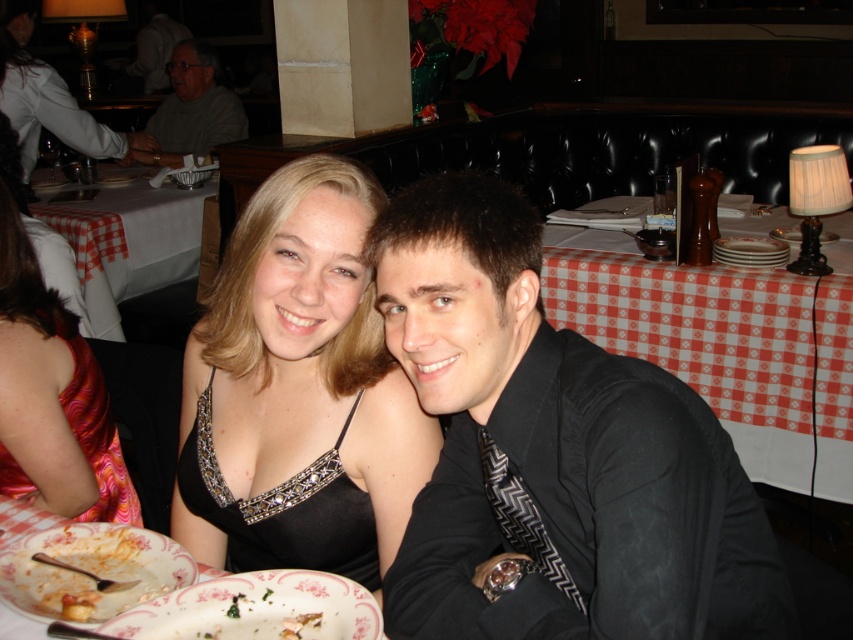
You are a restaurant server who needs to place a new dessert plate on the table. The plate is the same size as the red checkered tablecloth at upper right. Can you fit the dessert plate on the orange printed dress at left without overlapping?

The red checkered tablecloth at upper right is wider than the orange printed dress at left. Since the dessert plate is as large as the tablecloth, it won question fit on the orange printed dress at left due to its smaller size.

You are a photographer taking a picture of the scene. You notice the red checkered tablecloth at upper right and the orange printed dress at left. Which object appears taller in the photo?

The red checkered tablecloth at upper right appears taller than the orange printed dress at left in the photo.